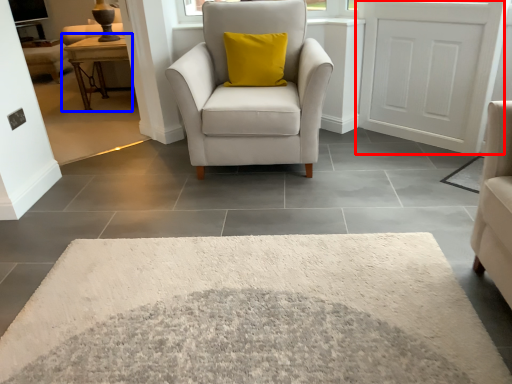
Question: Which object appears farthest to the camera in this image, door (highlighted by a red box) or table (highlighted by a blue box)?

Choices:
 (A) door
 (B) table

Answer: (B)